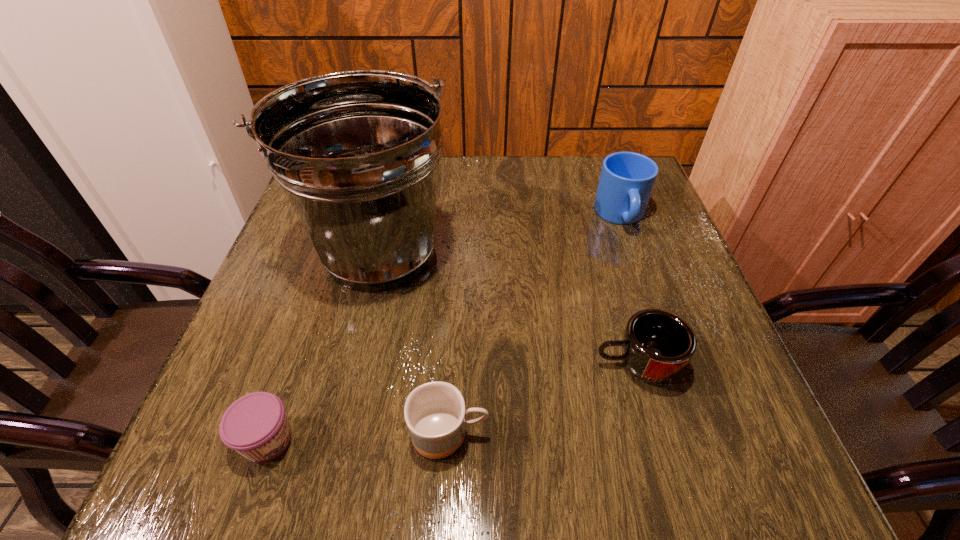
Find the location of `vacant area at the far edge`. vacant area at the far edge is located at coordinates (511, 186).

You are a GUI agent. You are given a task and a screenshot of the screen. Output one action in this format:
    pyautogui.click(x=<x>, y=<y>)
    Task: Click on the free space at the near edge of the desktop
    
    Given the screenshot: What is the action you would take?
    pyautogui.click(x=332, y=433)

You are a GUI agent. You are given a task and a screenshot of the screen. Output one action in this format:
    pyautogui.click(x=<x>, y=<y>)
    Task: Click on the vacant space at the right edge
    
    Given the screenshot: What is the action you would take?
    pyautogui.click(x=671, y=242)

Identify the location of blank space at the far right corner of the desktop. (652, 198).

Find the location of `free space at the near right corner of the desktop`. free space at the near right corner of the desktop is located at coordinates (691, 434).

I want to click on vacant space in between the jam and the fourth shortest object, so click(444, 328).

Locate an element on the screen. free space between the tallest object and the third nearest object is located at coordinates click(507, 308).

You are a GUI agent. You are given a task and a screenshot of the screen. Output one action in this format:
    pyautogui.click(x=<x>, y=<y>)
    Task: Click on the free spot between the second nearest mug and the bucket
    The image size is (960, 540).
    Given the screenshot: What is the action you would take?
    pyautogui.click(x=507, y=308)

At what (x,y) coordinates should I click in order to perform the action: click on free point between the jam and the fourth shortest object. Please return your answer as a coordinate pair (x, y). This screenshot has height=540, width=960. Looking at the image, I should click on (444, 328).

At what (x,y) coordinates should I click in order to perform the action: click on vacant space that is in between the tallest mug and the leftmost mug. Please return your answer as a coordinate pair (x, y). The image size is (960, 540). Looking at the image, I should click on (535, 325).